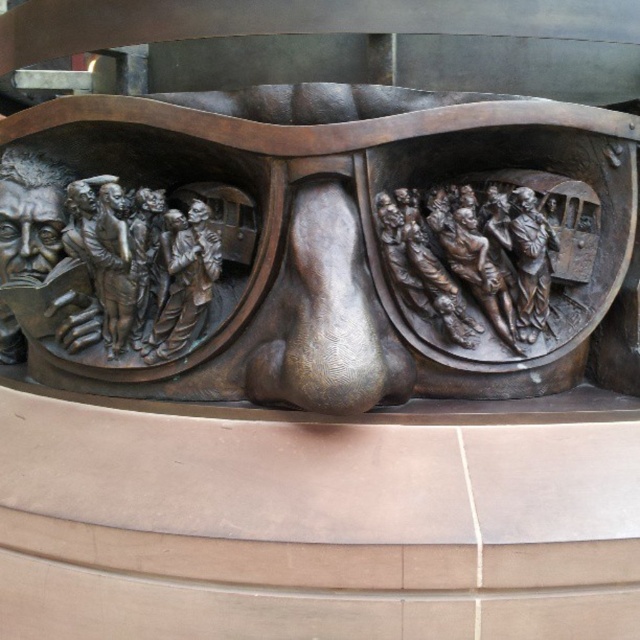
You are standing in front of the bronze sculpture at center and want to see the bronze relief figures at right. Which direction should you move to get a better view of them?

You should move to the right side of the bronze sculpture at center to see the bronze relief figures at right, as the sculpture is in front of them and moving sideways would allow you to view around it.

You are an art conservator assessing the bronze sculpture at center and the bronze relief figures at right. Based on their sizes, which object would require a larger storage space when not on display?

The bronze sculpture at center requires a larger storage space because it is larger in size than the bronze relief figures at right.